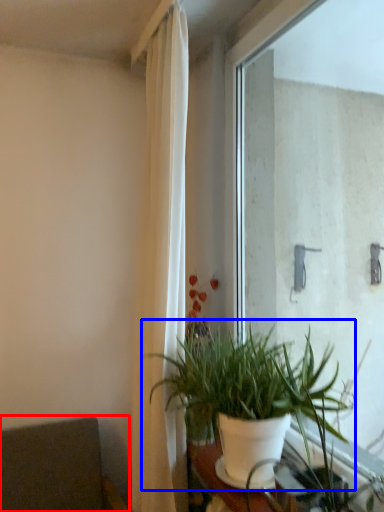
Question: Which object appears closest to the camera in this image, armchair (highlighted by a red box) or houseplant (highlighted by a blue box)?

Choices:
 (A) armchair
 (B) houseplant

Answer: (B)